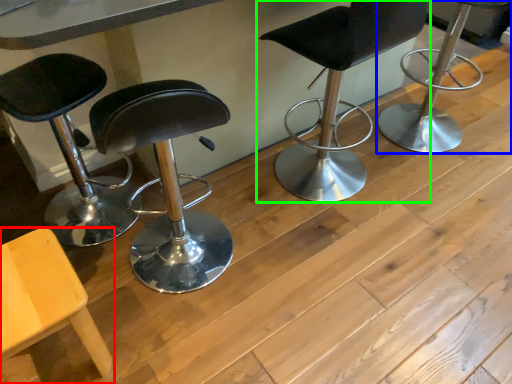
Question: Based on their relative distances, which object is nearer to chair (highlighted by a red box)? Choose from chair (highlighted by a blue box) and chair (highlighted by a green box).

Choices:
 (A) chair
 (B) chair

Answer: (B)